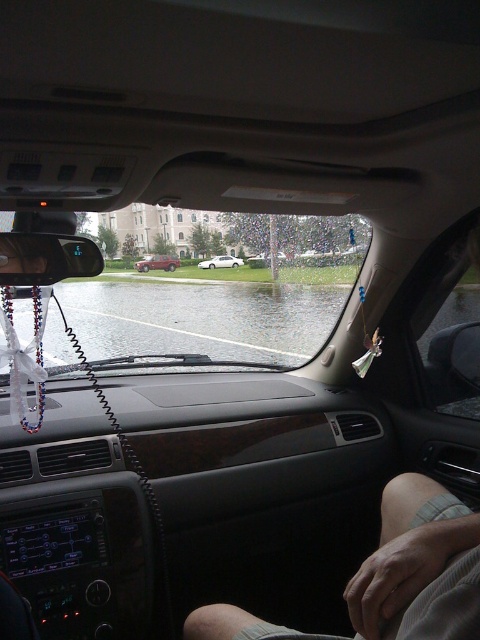
You are a photographer standing inside the car with your camera. You see the skinny shorts at lower right and your camera. Which object is closer to the front windshield?

The skinny shorts at lower right are closer to the front windshield than the camera because they are 67.13 centimeters apart from each other.